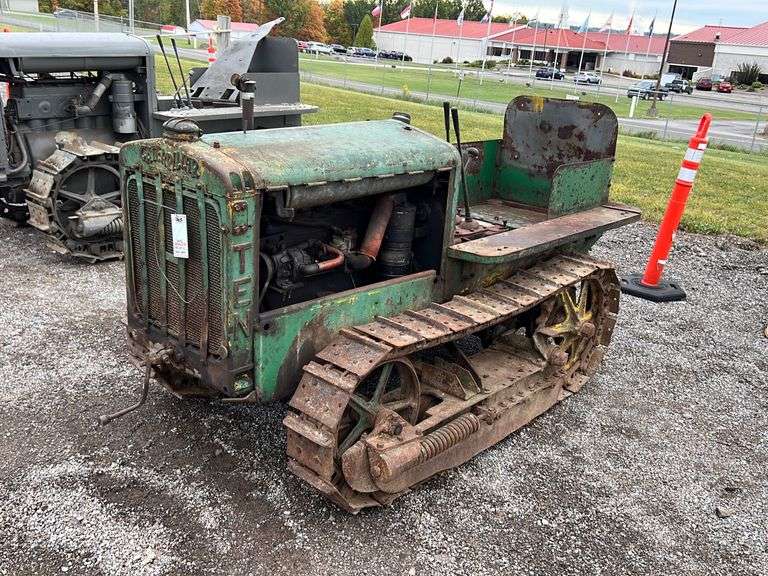
Locate an element on the screen. The height and width of the screenshot is (576, 768). seat is located at coordinates (217, 72), (518, 181).